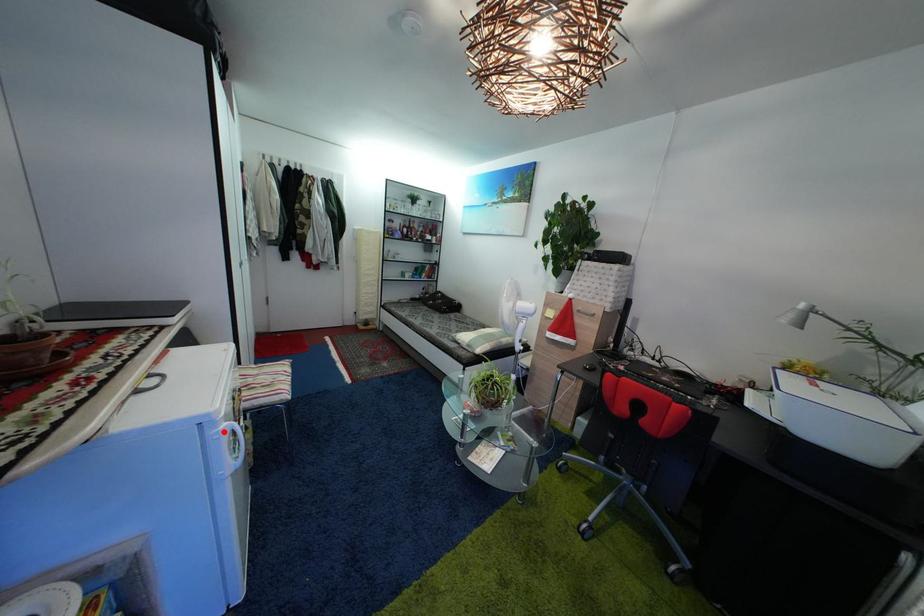
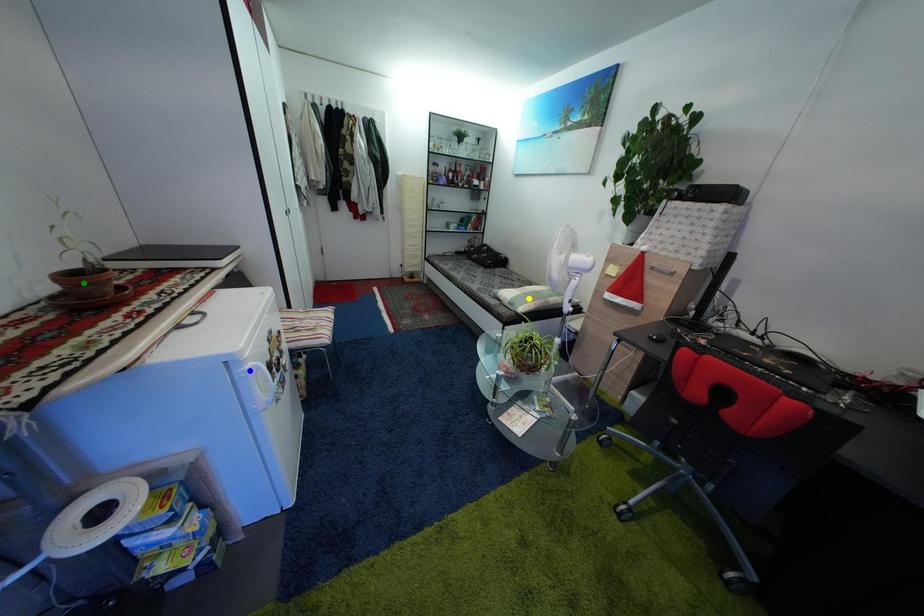
Question: I am providing you with two images of the same scene from different viewpoints. A red point is marked on the first image. You are given multiple points on the second image. Which mark in image 2 goes with the point in image 1?

Choices:
 (A) blue point
 (B) yellow point
 (C) green point

Answer: (A)